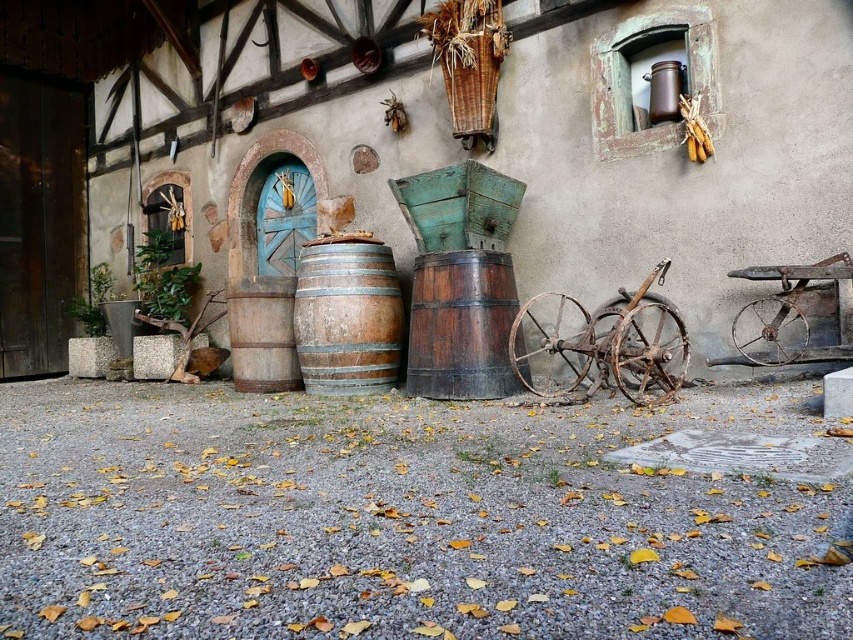
Can you confirm if rustic wooden barrel at center is thinner than rusty metal wagon at right?

In fact, rustic wooden barrel at center might be wider than rusty metal wagon at right.

Does rustic wooden barrel at center appear on the right side of rusty metal wagon at right?

No, rustic wooden barrel at center is not to the right of rusty metal wagon at right.

I want to click on rustic wooden barrel at center, so click(347, 316).

Is dark brown wooden barrel at center below rusty metal wagon at right?

Correct, dark brown wooden barrel at center is located below rusty metal wagon at right.

Does point (422, 266) lie in front of point (827, 330)?

No, it is behind (827, 330).

Image resolution: width=853 pixels, height=640 pixels. I want to click on dark brown wooden barrel at center, so click(461, 324).

Looking at this image, which is more to the right, rustic wooden barrel at center or dark brown wooden barrel at center?

dark brown wooden barrel at center is more to the right.

Is rustic wooden barrel at center taller than dark brown wooden barrel at center?

Yes, rustic wooden barrel at center is taller than dark brown wooden barrel at center.

Does point (370, 280) lie behind point (514, 381)?

That is True.

You are a GUI agent. You are given a task and a screenshot of the screen. Output one action in this format:
    pyautogui.click(x=<x>, y=<y>)
    Task: Click on the rustic wooden barrel at center
    
    Given the screenshot: What is the action you would take?
    pyautogui.click(x=347, y=316)